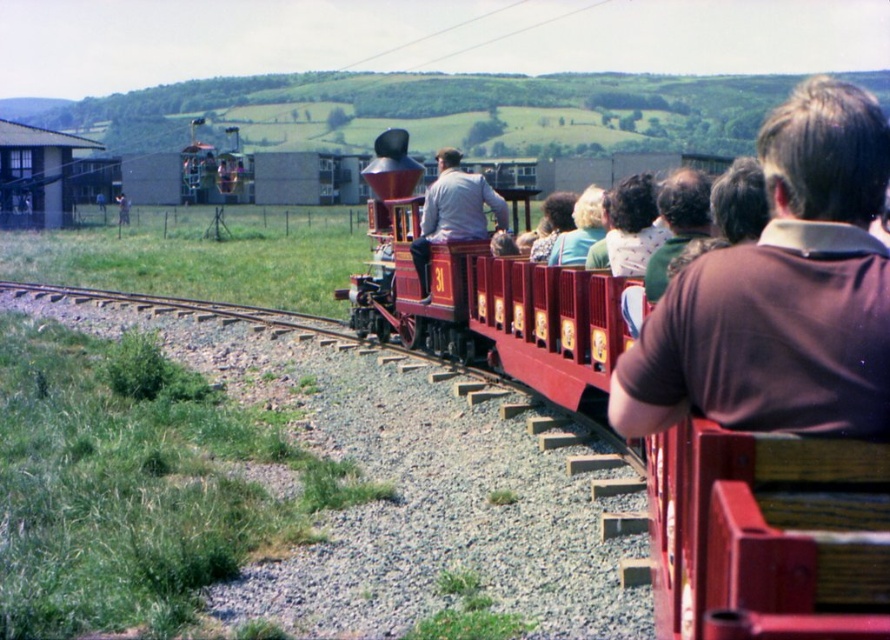
Can you confirm if wooden bench at center is positioned above brown shirt at upper right?

Yes.

Does point (709, 564) come farther from viewer compared to point (701, 298)?

No, it is not.

At what (x,y) coordinates should I click in order to perform the action: click on wooden bench at center. Please return your answer as a coordinate pair (x, y). The width and height of the screenshot is (890, 640). Looking at the image, I should click on (765, 524).

Which is above, brown shirt at upper right or light gray fabric jacket at center?

light gray fabric jacket at center is above.

Locate an element on the screen. brown shirt at upper right is located at coordinates (781, 292).

Where is `brown shirt at upper right`? This screenshot has height=640, width=890. brown shirt at upper right is located at coordinates (781, 292).

Is wooden bench at center below light gray fabric jacket at center?

Yes.

Is point (384, 141) farther from camera compared to point (419, 273)?

Yes, it is behind point (419, 273).

The width and height of the screenshot is (890, 640). In order to click on wooden bench at center in this screenshot , I will do `click(765, 524)`.

You are a GUI agent. You are given a task and a screenshot of the screen. Output one action in this format:
    pyautogui.click(x=<x>, y=<y>)
    Task: Click on the wooden bench at center
    
    Given the screenshot: What is the action you would take?
    (x=765, y=524)